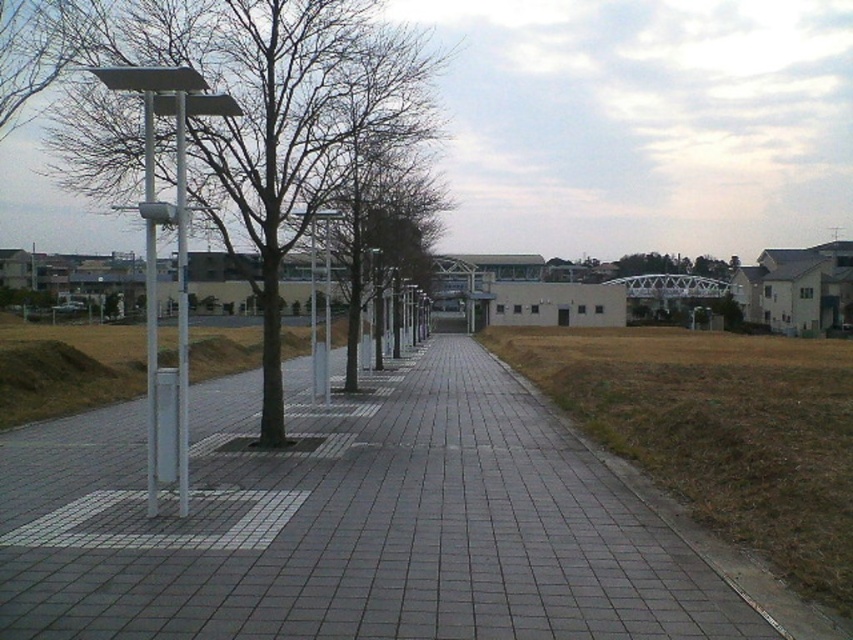
Question: Does smooth gray tree at center have a smaller size compared to metallic pole at left?

Choices:
 (A) yes
 (B) no

Answer: (B)

Question: Based on their relative distances, which object is farther from the metallic silver pole at left?

Choices:
 (A) smooth gray tree at center
 (B) metallic pole at left
 (C) gray concrete pavement at center

Answer: (A)

Question: Estimate the real-world distances between objects in this image. Which object is closer to the smooth gray tree at center?

Choices:
 (A) metallic pole at left
 (B) gray concrete pavement at center

Answer: (B)

Question: Which of the following is the closest to the observer?

Choices:
 (A) (322, 52)
 (B) (149, 145)
 (C) (187, 444)
 (D) (537, 416)

Answer: (B)

Question: Is smooth gray tree at center bigger than metallic pole at left?

Choices:
 (A) no
 (B) yes

Answer: (B)

Question: Can you confirm if metallic pole at left is smaller than metallic silver pole at left?

Choices:
 (A) no
 (B) yes

Answer: (B)